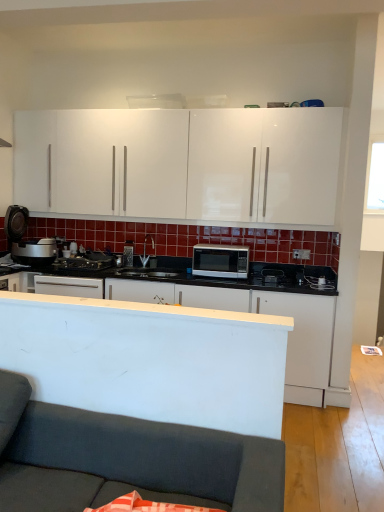
The width and height of the screenshot is (384, 512). What do you see at coordinates (182, 164) in the screenshot?
I see `white glossy cabinets at upper center, acting as the 1th cabinetry starting from the top` at bounding box center [182, 164].

What is the approximate height of white glossy cabinets at upper center, acting as the 1th cabinetry starting from the top?

94.88 centimeters.

This screenshot has height=512, width=384. What do you see at coordinates (127, 460) in the screenshot?
I see `dark gray fabric couch at lower left` at bounding box center [127, 460].

This screenshot has width=384, height=512. Find the location of `white matte microwave at center, which is counted as the first cabinetry, starting from the bottom`. white matte microwave at center, which is counted as the first cabinetry, starting from the bottom is located at coordinates (247, 311).

Do you think white glossy cabinets at upper center, acting as the 2th cabinetry starting from the bottom, is within white matte microwave at center, which is counted as the first cabinetry, starting from the bottom, or outside of it?

white glossy cabinets at upper center, acting as the 2th cabinetry starting from the bottom, exists outside the volume of white matte microwave at center, which is counted as the first cabinetry, starting from the bottom.

Does white glossy cabinets at upper center, acting as the 2th cabinetry starting from the bottom, have a smaller size compared to white matte microwave at center, the second cabinetry from the top?

Yes, white glossy cabinets at upper center, acting as the 2th cabinetry starting from the bottom, is smaller than white matte microwave at center, the second cabinetry from the top.

Can you tell me how much white glossy cabinets at upper center, acting as the 1th cabinetry starting from the top, and white matte microwave at center, the second cabinetry from the top, differ in facing direction?

The angular difference between white glossy cabinets at upper center, acting as the 1th cabinetry starting from the top, and white matte microwave at center, the second cabinetry from the top, is 0.296 degrees.

Locate an element on the screen. This screenshot has width=384, height=512. cabinetry that is under the white glossy cabinets at upper center, acting as the 2th cabinetry starting from the bottom (from a real-world perspective) is located at coordinates (247, 311).

From the image's perspective, is satin silver microwave at center below white matte microwave at center, which is counted as the first cabinetry, starting from the bottom?

No, from the image's perspective, satin silver microwave at center is not below white matte microwave at center, which is counted as the first cabinetry, starting from the bottom.

Where is `cabinetry below the satin silver microwave at center (from the image's perspective)`? Image resolution: width=384 pixels, height=512 pixels. cabinetry below the satin silver microwave at center (from the image's perspective) is located at coordinates (247, 311).

Are satin silver microwave at center and white matte microwave at center, the second cabinetry from the top, far apart?

No, satin silver microwave at center is in close proximity to white matte microwave at center, the second cabinetry from the top.

From the picture: Considering their positions, is satin silver microwave at center located in front of or behind white matte microwave at center, which is counted as the first cabinetry, starting from the bottom?

In the image, satin silver microwave at center appears behind white matte microwave at center, which is counted as the first cabinetry, starting from the bottom.

Considering the sizes of objects dark gray fabric couch at lower left and satin silver microwave at center in the image provided, who is smaller, dark gray fabric couch at lower left or satin silver microwave at center?

Smaller between the two is satin silver microwave at center.

Is dark gray fabric couch at lower left aimed at satin silver microwave at center?

No, dark gray fabric couch at lower left is not aimed at satin silver microwave at center.

What's the angular difference between dark gray fabric couch at lower left and satin silver microwave at center's facing directions?

There is a 0.00266-degree angle between the facing directions of dark gray fabric couch at lower left and satin silver microwave at center.

Which is correct: dark gray fabric couch at lower left is inside satin silver microwave at center, or outside of it?

dark gray fabric couch at lower left is spatially situated outside satin silver microwave at center.

Does satin silver microwave at center have a greater width compared to white glossy cabinets at upper center, acting as the 2th cabinetry starting from the bottom?

Yes, satin silver microwave at center is wider than white glossy cabinets at upper center, acting as the 2th cabinetry starting from the bottom.

Identify the location of microwave oven behind the white glossy cabinets at upper center, acting as the 2th cabinetry starting from the bottom. pos(220,261).

How different are the orientations of satin silver microwave at center and white glossy cabinets at upper center, acting as the 1th cabinetry starting from the top, in degrees?

They differ by 0.00145 degrees in their facing directions.

Considering the sizes of objects white matte microwave at center, the second cabinetry from the top, and dark gray fabric couch at lower left in the image provided, who is shorter, white matte microwave at center, the second cabinetry from the top, or dark gray fabric couch at lower left?

dark gray fabric couch at lower left is shorter.

Is white matte microwave at center, which is counted as the first cabinetry, starting from the bottom, not within dark gray fabric couch at lower left?

white matte microwave at center, which is counted as the first cabinetry, starting from the bottom, lies outside dark gray fabric couch at lower left's area.

Can you tell me how much white matte microwave at center, the second cabinetry from the top, and dark gray fabric couch at lower left differ in facing direction?

They differ by 0.295 degrees in their facing directions.

Which cabinetry is the 1st one when counting from the back of the dark gray fabric couch at lower left? Please provide its 2D coordinates.

[(247, 311)]

Between white glossy cabinets at upper center, acting as the 1th cabinetry starting from the top, and dark gray fabric couch at lower left, which one has smaller size?

With smaller size is dark gray fabric couch at lower left.

Considering the sizes of objects white glossy cabinets at upper center, acting as the 1th cabinetry starting from the top, and dark gray fabric couch at lower left in the image provided, who is taller, white glossy cabinets at upper center, acting as the 1th cabinetry starting from the top, or dark gray fabric couch at lower left?

white glossy cabinets at upper center, acting as the 1th cabinetry starting from the top.

Would you consider white glossy cabinets at upper center, acting as the 1th cabinetry starting from the top, to be distant from dark gray fabric couch at lower left?

white glossy cabinets at upper center, acting as the 1th cabinetry starting from the top, is positioned a significant distance from dark gray fabric couch at lower left.

Considering the relative sizes of white glossy cabinets at upper center, acting as the 1th cabinetry starting from the top, and dark gray fabric couch at lower left in the image provided, is white glossy cabinets at upper center, acting as the 1th cabinetry starting from the top, thinner than dark gray fabric couch at lower left?

Yes.

Is white glossy cabinets at upper center, acting as the 1th cabinetry starting from the top, positioned far away from satin silver microwave at center?

white glossy cabinets at upper center, acting as the 1th cabinetry starting from the top, is near satin silver microwave at center, not far away.

Can you confirm if white glossy cabinets at upper center, acting as the 1th cabinetry starting from the top, is positioned to the right of satin silver microwave at center?

No.

Is white glossy cabinets at upper center, acting as the 2th cabinetry starting from the bottom, further to camera compared to satin silver microwave at center?

No, white glossy cabinets at upper center, acting as the 2th cabinetry starting from the bottom, is closer to the viewer.

Where is `cabinetry on the left of white glossy cabinets at upper center, acting as the 2th cabinetry starting from the bottom`? Image resolution: width=384 pixels, height=512 pixels. cabinetry on the left of white glossy cabinets at upper center, acting as the 2th cabinetry starting from the bottom is located at coordinates (247, 311).

This screenshot has height=512, width=384. I want to click on microwave oven behind the white matte microwave at center, which is counted as the first cabinetry, starting from the bottom, so click(220, 261).

Considering their positions, is transparent glass window at upper right positioned closer to satin silver microwave at center than dark gray fabric couch at lower left?

transparent glass window at upper right.

Looking at the image, which one is located closer to satin silver microwave at center, white matte microwave at center, the second cabinetry from the top, or white glossy cabinets at upper center, acting as the 2th cabinetry starting from the bottom?

white matte microwave at center, the second cabinetry from the top.

Considering their positions, is transparent glass window at upper right positioned further to dark gray fabric couch at lower left than white glossy cabinets at upper center, acting as the 1th cabinetry starting from the top?

transparent glass window at upper right is positioned further to the anchor dark gray fabric couch at lower left.

When comparing their distances from white glossy cabinets at upper center, acting as the 2th cabinetry starting from the bottom, does dark gray fabric couch at lower left or white matte microwave at center, which is counted as the first cabinetry, starting from the bottom, seem further?

Based on the image, dark gray fabric couch at lower left appears to be further to white glossy cabinets at upper center, acting as the 2th cabinetry starting from the bottom.

Considering their positions, is white matte microwave at center, which is counted as the first cabinetry, starting from the bottom, positioned further to dark gray fabric couch at lower left than white glossy cabinets at upper center, acting as the 2th cabinetry starting from the bottom?

Based on the image, white glossy cabinets at upper center, acting as the 2th cabinetry starting from the bottom, appears to be further to dark gray fabric couch at lower left.

Looking at this image, considering their positions, is white glossy cabinets at upper center, acting as the 1th cabinetry starting from the top, positioned closer to satin silver microwave at center than transparent glass window at upper right?

white glossy cabinets at upper center, acting as the 1th cabinetry starting from the top.

From the image, which object appears to be farther from satin silver microwave at center, dark gray fabric couch at lower left or white glossy cabinets at upper center, acting as the 2th cabinetry starting from the bottom?

dark gray fabric couch at lower left is positioned further to the anchor satin silver microwave at center.

Looking at the image, which one is located further to dark gray fabric couch at lower left, satin silver microwave at center or white glossy cabinets at upper center, acting as the 1th cabinetry starting from the top?

white glossy cabinets at upper center, acting as the 1th cabinetry starting from the top, is further to dark gray fabric couch at lower left.

Where is `microwave oven between white glossy cabinets at upper center, acting as the 2th cabinetry starting from the bottom, and white matte microwave at center, which is counted as the first cabinetry, starting from the bottom, in the vertical direction`? The width and height of the screenshot is (384, 512). microwave oven between white glossy cabinets at upper center, acting as the 2th cabinetry starting from the bottom, and white matte microwave at center, which is counted as the first cabinetry, starting from the bottom, in the vertical direction is located at coordinates click(220, 261).

I want to click on cabinetry located between dark gray fabric couch at lower left and white glossy cabinets at upper center, acting as the 1th cabinetry starting from the top, in the depth direction, so click(x=247, y=311).

Locate an element on the screen. cabinetry between white matte microwave at center, the second cabinetry from the top, and transparent glass window at upper right is located at coordinates (182, 164).

The width and height of the screenshot is (384, 512). I want to click on microwave oven between white matte microwave at center, which is counted as the first cabinetry, starting from the bottom, and transparent glass window at upper right, so click(220, 261).